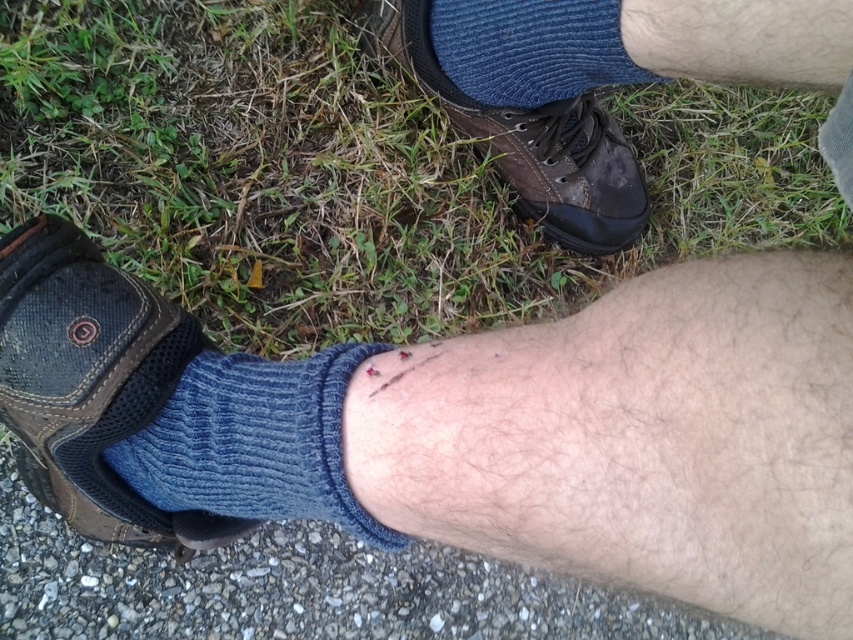
Question: Observing the image, what is the correct spatial positioning of blue knitted sock at lower center in reference to leather shoe at center?

Choices:
 (A) left
 (B) right

Answer: (A)

Question: Is blue knitted sock at lower center wider than leather shoe at center?

Choices:
 (A) yes
 (B) no

Answer: (B)

Question: Considering the real-world distances, which object is farthest from the blue knitted sock at lower center?

Choices:
 (A) blue knitted sock at upper center
 (B) leather shoe at center

Answer: (B)

Question: Estimate the real-world distances between objects in this image. Which object is farther from the blue knitted sock at upper center?

Choices:
 (A) leather shoe at center
 (B) dark brown leather shoe at lower left

Answer: (B)

Question: Observing the image, what is the correct spatial positioning of dark brown leather shoe at lower left in reference to blue knitted sock at upper center?

Choices:
 (A) below
 (B) above

Answer: (A)

Question: Based on their relative distances, which object is farther from the blue knitted sock at lower center?

Choices:
 (A) blue knitted sock at upper center
 (B) leather shoe at center
 (C) dark brown leather shoe at lower left

Answer: (B)